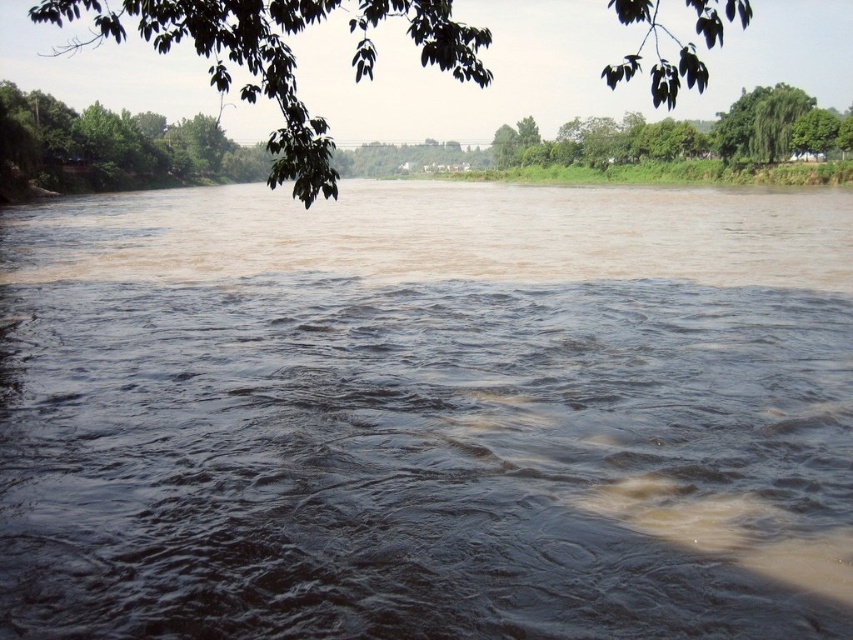
Consider the image. You are a geologist studying the riverbed composition. You have a device that can analyze water samples at specific coordinates. According to the coordinates provided, where exactly would you collect a sample to analyze the brown muddy water at center?

The brown muddy water at center is located at coordinates point (427, 413), so you should collect the sample there.

You are a kayaker planning to navigate the river shown in the image. You notice the brown muddy water at center and the green leafy tree at upper center. Which object is positioned higher in the scene?

The green leafy tree at upper center is positioned higher in the scene as it is located above the brown muddy water at center.